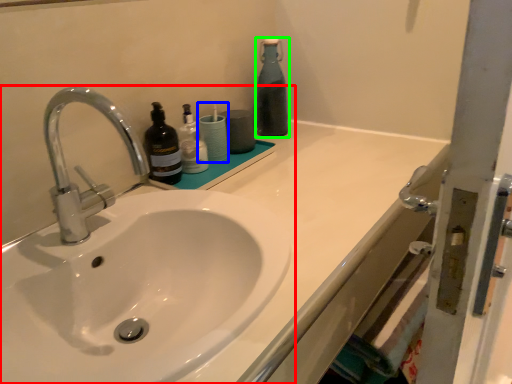
Question: Considering the real-world distances, which object is farthest from sink (highlighted by a red box)? toiletry (highlighted by a blue box) or bottle (highlighted by a green box)?

Choices:
 (A) toiletry
 (B) bottle

Answer: (B)